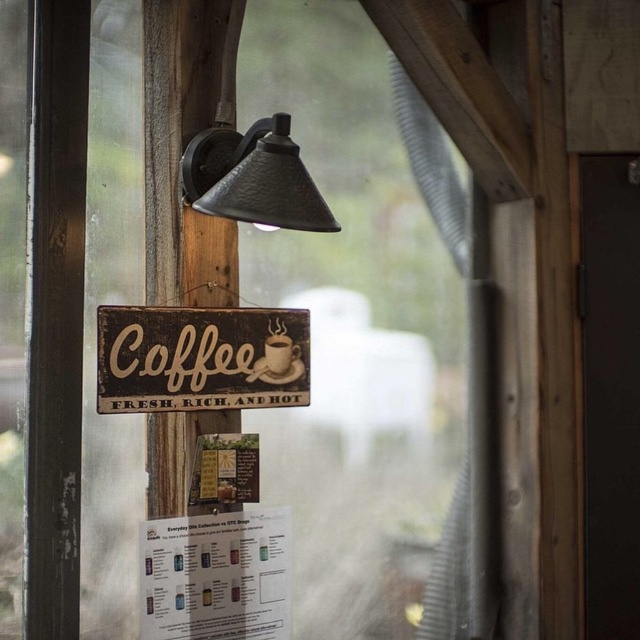
Question: Among these objects, which one is nearest to the camera?

Choices:
 (A) matte black lamp at upper center
 (B) rustic wood sign at center

Answer: (A)

Question: Which point is closer to the camera?

Choices:
 (A) rustic wood sign at center
 (B) matte black lamp at upper center
 (C) matte ceramic mug at center

Answer: (B)

Question: Is rustic wood sign at center bigger than matte ceramic mug at center?

Choices:
 (A) yes
 (B) no

Answer: (A)

Question: Is rustic wood sign at center behind matte black lamp at upper center?

Choices:
 (A) no
 (B) yes

Answer: (B)

Question: Which point is farther from the camera taking this photo?

Choices:
 (A) (284, 193)
 (B) (284, 390)

Answer: (B)

Question: Observing the image, what is the correct spatial positioning of rustic wood sign at center in reference to matte black lamp at upper center?

Choices:
 (A) below
 (B) above

Answer: (A)